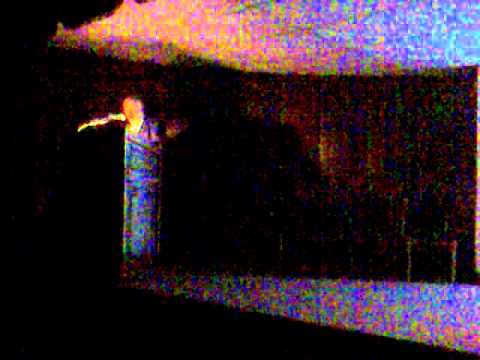
Where is `walls`? The height and width of the screenshot is (360, 480). walls is located at coordinates (409, 153), (273, 141).